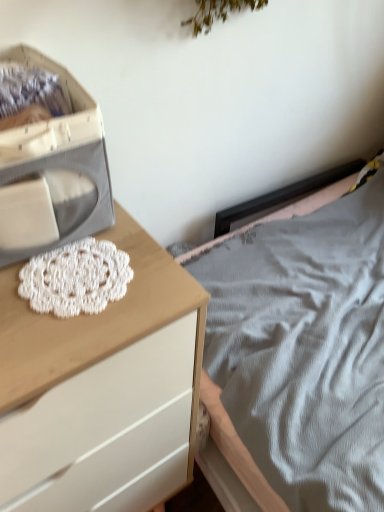
Question: Is white crochet doily at center-left facing towards white wood chest of drawers at left?

Choices:
 (A) no
 (B) yes

Answer: (B)

Question: Considering the relative positions of white crochet doily at center-left and white wood chest of drawers at left in the image provided, is white crochet doily at center-left to the left of white wood chest of drawers at left from the viewer's perspective?

Choices:
 (A) no
 (B) yes

Answer: (A)

Question: From the image's perspective, is white crochet doily at center-left beneath white wood chest of drawers at left?

Choices:
 (A) no
 (B) yes

Answer: (A)

Question: Does white crochet doily at center-left have a lesser width compared to white wood chest of drawers at left?

Choices:
 (A) no
 (B) yes

Answer: (B)

Question: Is white wood chest of drawers at left completely or partially inside white crochet doily at center-left?

Choices:
 (A) yes
 (B) no

Answer: (B)

Question: From the image's perspective, is white crochet doily at center-left located above or below white fabric storage box at left?

Choices:
 (A) below
 (B) above

Answer: (A)

Question: From a real-world perspective, is white crochet doily at center-left above or below white fabric storage box at left?

Choices:
 (A) below
 (B) above

Answer: (A)

Question: From their relative heights in the image, would you say white crochet doily at center-left is taller or shorter than white fabric storage box at left?

Choices:
 (A) tall
 (B) short

Answer: (B)

Question: Based on their positions, is white crochet doily at center-left located to the left or right of white fabric storage box at left?

Choices:
 (A) right
 (B) left

Answer: (A)

Question: From a real-world perspective, is white wood chest of drawers at left above or below white fabric storage box at left?

Choices:
 (A) below
 (B) above

Answer: (A)

Question: In terms of height, does white wood chest of drawers at left look taller or shorter compared to white fabric storage box at left?

Choices:
 (A) short
 (B) tall

Answer: (B)

Question: Visually, is white wood chest of drawers at left positioned to the left or to the right of white fabric storage box at left?

Choices:
 (A) right
 (B) left

Answer: (B)

Question: Considering their positions, is white wood chest of drawers at left located in front of or behind white fabric storage box at left?

Choices:
 (A) front
 (B) behind

Answer: (A)

Question: Is white fabric storage box at left situated inside white wood chest of drawers at left or outside?

Choices:
 (A) outside
 (B) inside

Answer: (A)

Question: From a real-world perspective, is white fabric storage box at left physically located above or below white wood chest of drawers at left?

Choices:
 (A) above
 (B) below

Answer: (A)